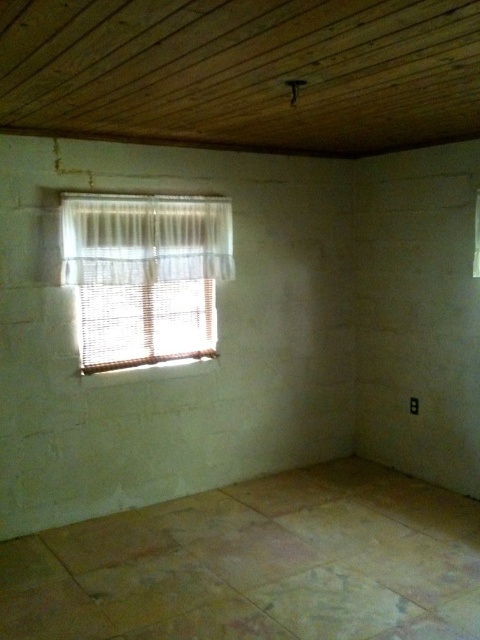
You are standing in the room and want to adjust the lighting by opening or closing the white woven blinds at left and the white sheer curtain at upper left. Which object should you adjust first to control the light coming through the window?

You should adjust the white sheer curtain at upper left first because it is located above the white woven blinds at left, so it is closer to the light source and can block or allow more light before it reaches the blinds.

You are standing in the room and want to adjust the lighting by moving the white woven blinds at left and the white sheer curtain at upper left. Which object should you move first if you want to let more light into the room?

The white woven blinds at left is positioned on the right side of white sheer curtain at upper left. To let more light in, you should move the white woven blinds at left first because it is closer to the light source and adjusting it would allow more light to pass through the white sheer curtain at upper left.